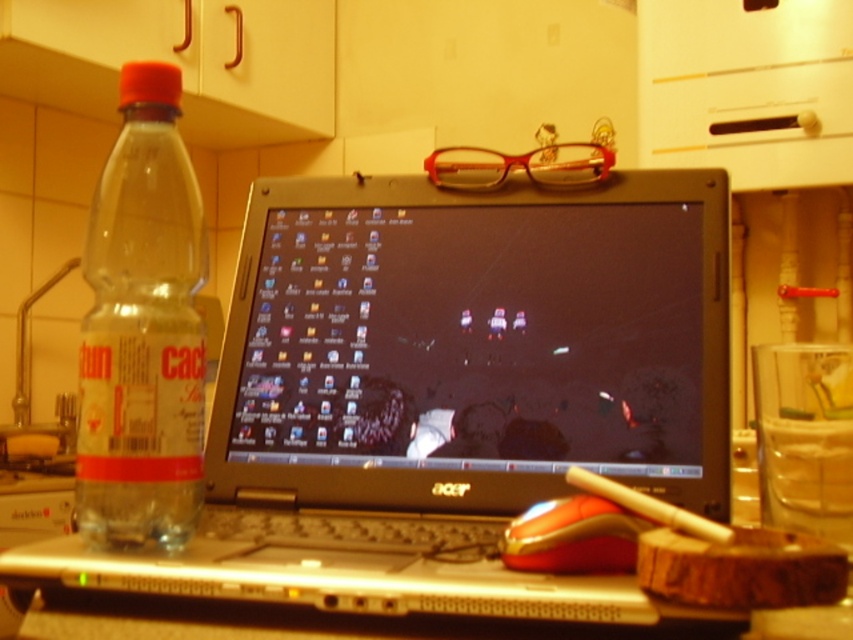
You are organizing items on a shelf and need to place the clear plastic bottle at left and the translucent orange plastic glasses at upper center. Which item should you place first if you want to arrange them from tallest to shortest?

The clear plastic bottle at left is taller than the translucent orange plastic glasses at upper center, so you should place the clear plastic bottle at left first when arranging from tallest to shortest.

You need to place both the metallic silver laptop at center and the clear plastic bottle at left into a storage box. The box can only fit items that are smaller than the laptop. Which item will not fit into the box?

The metallic silver laptop at center is larger in size than the clear plastic bottle at left, so the metallic silver laptop at center will not fit into the box.